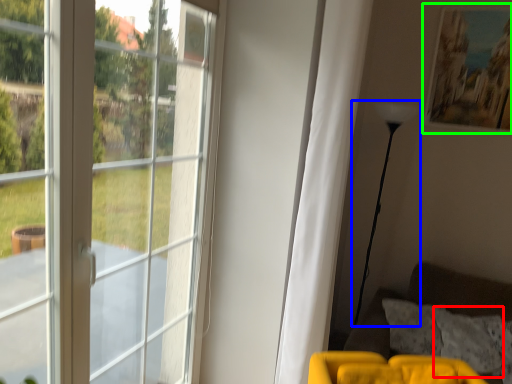
Question: Considering the real-world distances, which object is farthest from pillow (highlighted by a red box)? lamp (highlighted by a blue box) or picture frame (highlighted by a green box)?

Choices:
 (A) lamp
 (B) picture frame

Answer: (B)